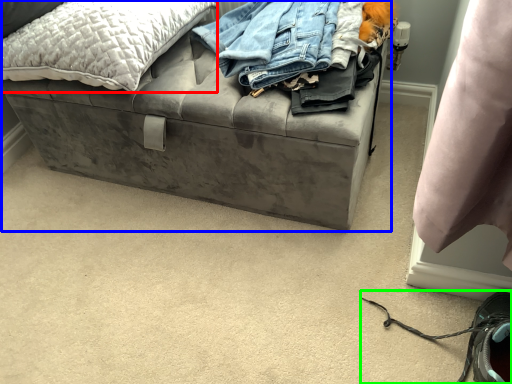
Question: Which object is the farthest from pillow (highlighted by a red box)? Choose among these: furniture (highlighted by a blue box) or shoe (highlighted by a green box).

Choices:
 (A) furniture
 (B) shoe

Answer: (B)